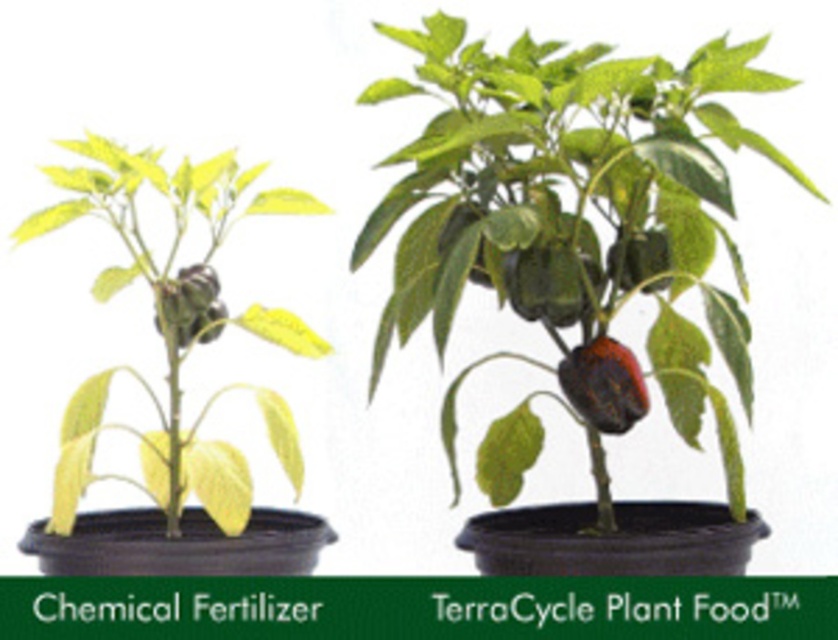
Is yellow matte leafy plant at left behind green matte pepper at left?

No, it is not.

You are a GUI agent. You are given a task and a screenshot of the screen. Output one action in this format:
    pyautogui.click(x=<x>, y=<y>)
    Task: Click on the yellow matte leafy plant at left
    This screenshot has height=640, width=838.
    Given the screenshot: What is the action you would take?
    pyautogui.click(x=163, y=333)

Where is `yellow matte leafy plant at left`? The height and width of the screenshot is (640, 838). yellow matte leafy plant at left is located at coordinates (163, 333).

Locate an element on the screen. This screenshot has height=640, width=838. yellow matte leafy plant at left is located at coordinates (163, 333).

Does green matte pepper at center come behind shiny dark red pepper at center?

No.

What do you see at coordinates (573, 202) in the screenshot? This screenshot has width=838, height=640. I see `green matte pepper at center` at bounding box center [573, 202].

Locate an element on the screen. green matte pepper at center is located at coordinates (573, 202).

Is green matte pepper at left smaller than green matte pepper at upper center?

No.

Who is positioned more to the right, green matte pepper at left or green matte pepper at upper center?

green matte pepper at upper center

Identify the location of green matte pepper at left. The height and width of the screenshot is (640, 838). (192, 301).

Where is `green matte pepper at left`? green matte pepper at left is located at coordinates (192, 301).